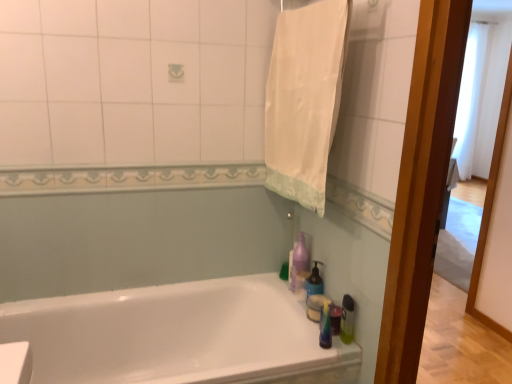
Image resolution: width=512 pixels, height=384 pixels. Identify the location of vacant space underneath white cotton towel at upper right (from a real-world perspective). (292, 301).